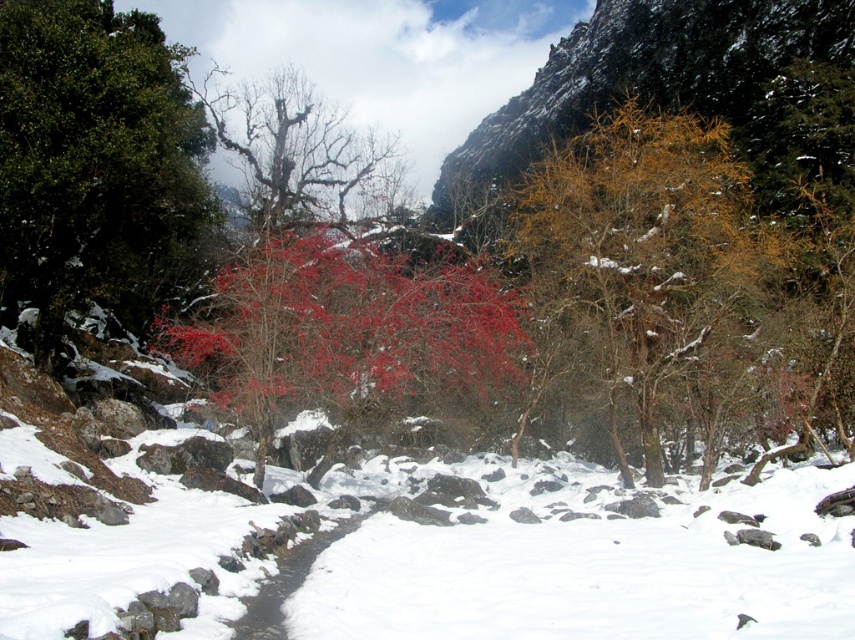
Where is `green glossy tree at center`? This screenshot has width=855, height=640. green glossy tree at center is located at coordinates (93, 163).

Does point (144, 131) lie in front of point (279, 160)?

That is True.

Who is more forward, (193, 182) or (388, 157)?

Positioned in front is point (193, 182).

This screenshot has width=855, height=640. Identify the location of green glossy tree at center. (93, 163).

Does white fluffy snow at center come in front of bright red leaves at center?

Yes, it is in front of bright red leaves at center.

Is white fluffy snow at center bigger than bright red leaves at center?

Indeed, white fluffy snow at center has a larger size compared to bright red leaves at center.

Is point (3, 493) in front of point (311, 268)?

Yes, point (3, 493) is in front of point (311, 268).

The height and width of the screenshot is (640, 855). I want to click on white fluffy snow at center, so click(x=393, y=541).

Who is more forward, [587,524] or [722,280]?

Point [587,524] is more forward.

Is white fluffy snow at center closer to the viewer compared to yellow-brown textured tree at center-right?

Yes, white fluffy snow at center is closer to the viewer.

Which is in front, point (447, 513) or point (702, 237)?

Positioned in front is point (447, 513).

The image size is (855, 640). Identify the location of white fluffy snow at center. (393, 541).